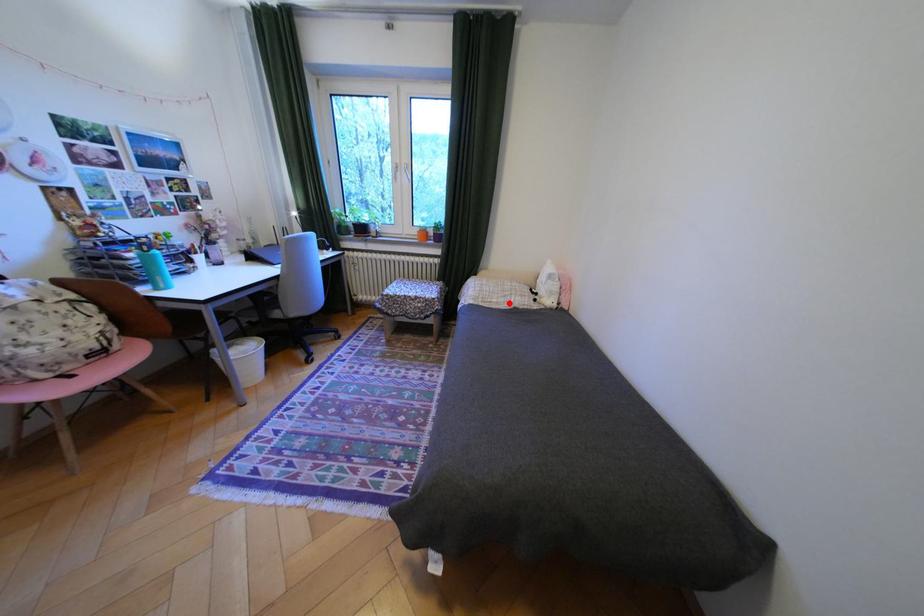
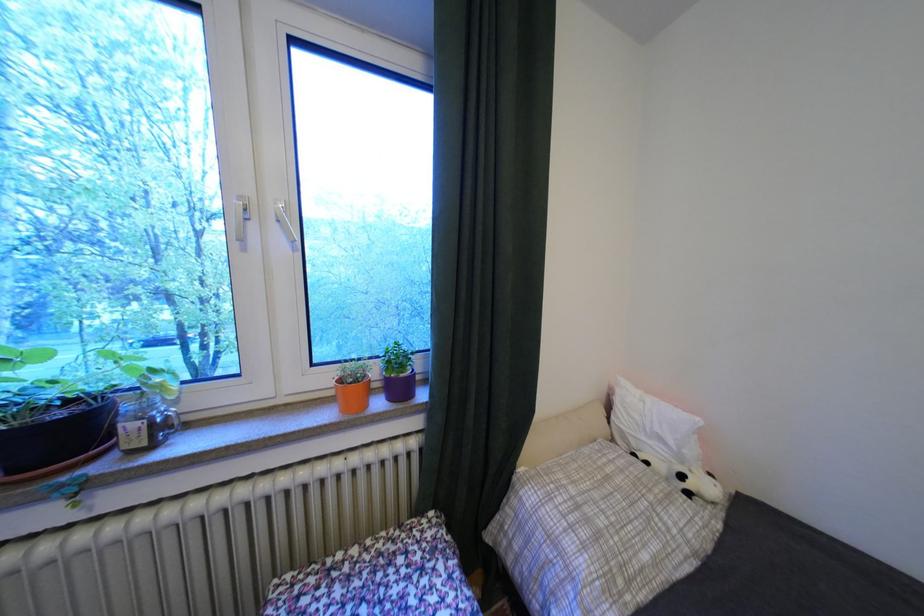
The point at the highlighted location is marked in the first image. Where is the corresponding point in the second image?

(667, 562)